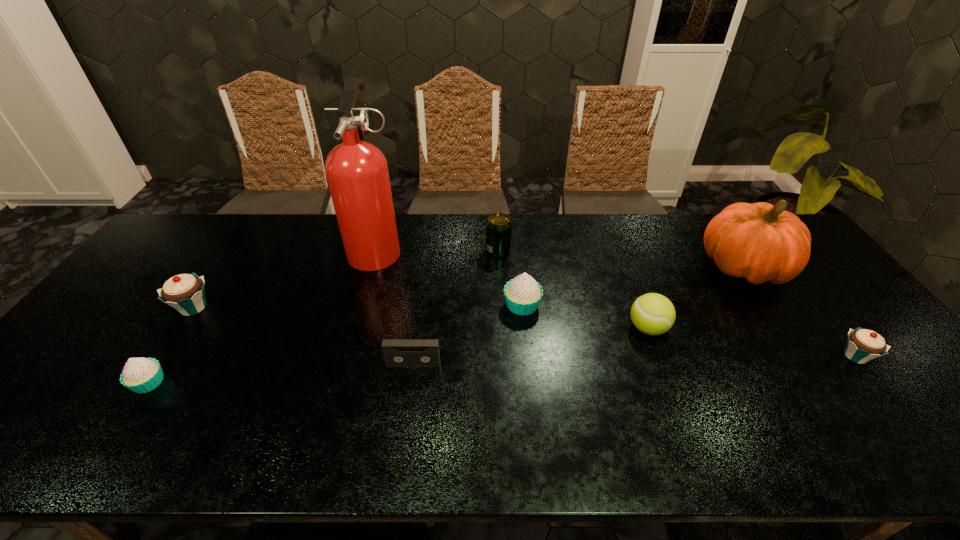
Where is `vacant space that is in between the pumpkin and the green beer can`? This screenshot has width=960, height=540. vacant space that is in between the pumpkin and the green beer can is located at coordinates (620, 259).

Locate an element on the screen. This screenshot has height=540, width=960. unoccupied area between the fourth object from left to right and the seventh object from left to right is located at coordinates (531, 346).

You are a GUI agent. You are given a task and a screenshot of the screen. Output one action in this format:
    pyautogui.click(x=<x>, y=<y>)
    Task: Click on the empty space between the right teal cupcake and the left teal cupcake
    The height and width of the screenshot is (540, 960).
    Given the screenshot: What is the action you would take?
    pyautogui.click(x=524, y=332)

Where is `object that can be found as the closest to the seventh object from left to right`? object that can be found as the closest to the seventh object from left to right is located at coordinates (760, 242).

Where is `object that is the seventh closest to the right white cupcake`? object that is the seventh closest to the right white cupcake is located at coordinates (185, 292).

Locate an element on the screen. This screenshot has width=960, height=540. the closest cupcake relative to the second cupcake from right to left is located at coordinates (863, 345).

The height and width of the screenshot is (540, 960). What are the coordinates of `the closest cupcake relative to the orange pumpkin` in the screenshot? It's located at (863, 345).

You are a GUI agent. You are given a task and a screenshot of the screen. Output one action in this format:
    pyautogui.click(x=<x>, y=<y>)
    Task: Click on the blank space that satisfies the following two spatial constraints: 1. on the front side of the beer can; 2. on the left side of the tallest object
    
    Given the screenshot: What is the action you would take?
    pyautogui.click(x=376, y=249)

Locate an element on the screen. The height and width of the screenshot is (540, 960). vacant region that satisfies the following two spatial constraints: 1. on the front side of the rightmost cupcake; 2. on the left side of the tallest object is located at coordinates (347, 356).